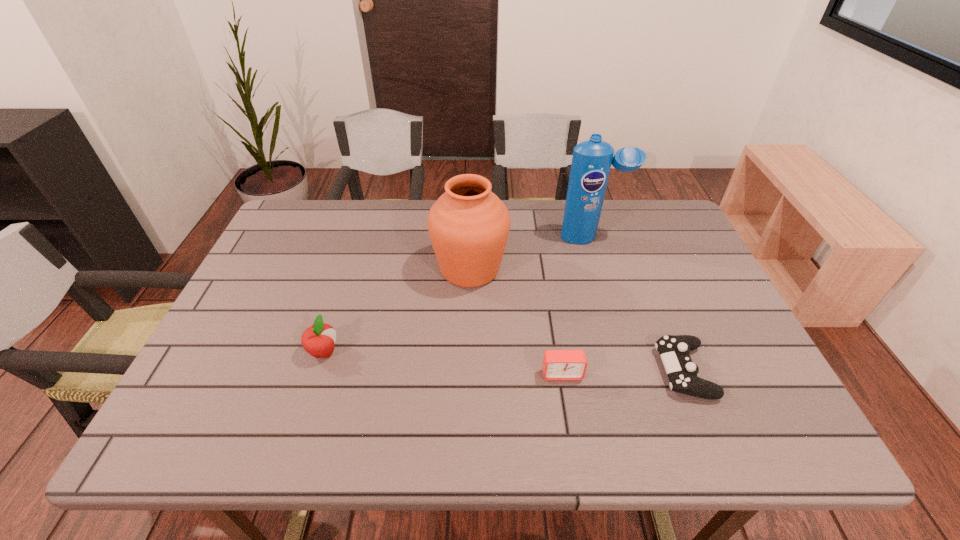
The width and height of the screenshot is (960, 540). I want to click on vacant area situated 0.190m on the back of the third tallest object, so click(x=346, y=284).

What are the coordinates of `free space located on the front-facing side of the fourth tallest object` in the screenshot? It's located at (573, 443).

Where is `free space located on the surface of the shortest object`? The height and width of the screenshot is (540, 960). free space located on the surface of the shortest object is located at coordinates (503, 371).

You are a GUI agent. You are given a task and a screenshot of the screen. Output one action in this format:
    pyautogui.click(x=<x>, y=<y>)
    Task: Click on the vacant space located 0.270m on the surface of the shortest object
    
    Given the screenshot: What is the action you would take?
    pyautogui.click(x=539, y=371)

At what (x,y) coordinates should I click in order to perform the action: click on blank space located 0.260m on the surface of the shortest object. Please return your answer as a coordinate pair (x, y). The height and width of the screenshot is (540, 960). Looking at the image, I should click on (543, 371).

The height and width of the screenshot is (540, 960). Identify the location of shampoo that is positioned at the far edge. (591, 162).

Where is `urn that is at the far edge`? urn that is at the far edge is located at coordinates (468, 225).

Identify the location of object that is at the right edge. The width and height of the screenshot is (960, 540). (674, 350).

Image resolution: width=960 pixels, height=540 pixels. Find the location of `vacant space at the far edge`. vacant space at the far edge is located at coordinates (410, 244).

Identify the location of free space at the near edge. (620, 438).